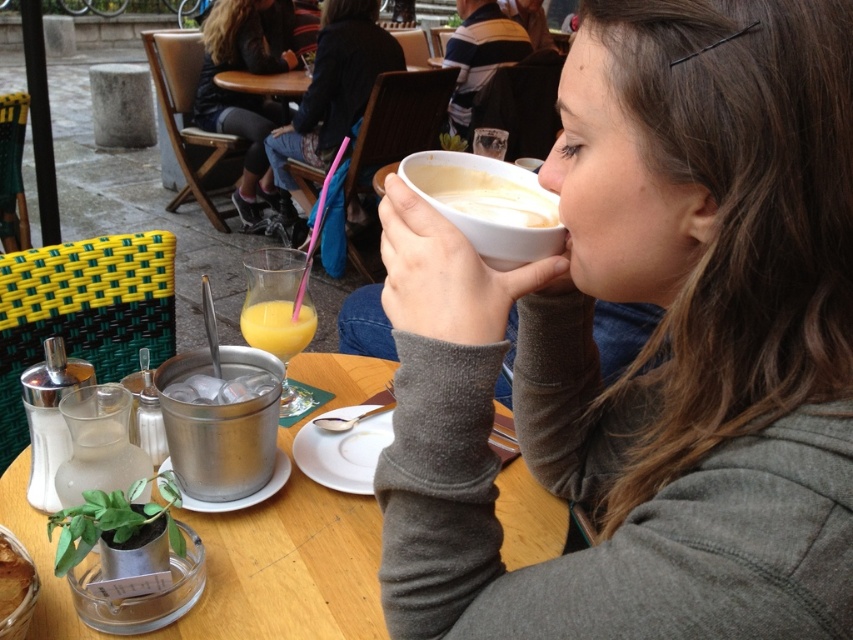
Which of these two, wooden table at center or matte plastic cup at upper center, stands shorter?

wooden table at center is shorter.

Does point (229, 540) come closer to viewer compared to point (270, 141)?

Yes, point (229, 540) is closer to viewer.

Where is `wooden table at center`? wooden table at center is located at coordinates (288, 570).

Measure the distance from matte plastic cup at upper center to translucent glass juice at center.

matte plastic cup at upper center is 8.32 feet from translucent glass juice at center.

Is matte plastic cup at upper center bigger than translucent glass juice at center?

Correct, matte plastic cup at upper center is larger in size than translucent glass juice at center.

Locate an element on the screen. matte plastic cup at upper center is located at coordinates (334, 88).

How much distance is there between white creamy latte at upper center and translucent glass bowl at lower left?

white creamy latte at upper center and translucent glass bowl at lower left are 20.34 inches apart from each other.

Who is positioned more to the left, white creamy latte at upper center or translucent glass bowl at lower left?

translucent glass bowl at lower left

What do you see at coordinates (482, 195) in the screenshot?
I see `white creamy latte at upper center` at bounding box center [482, 195].

Where is `white creamy latte at upper center`? This screenshot has height=640, width=853. white creamy latte at upper center is located at coordinates (482, 195).